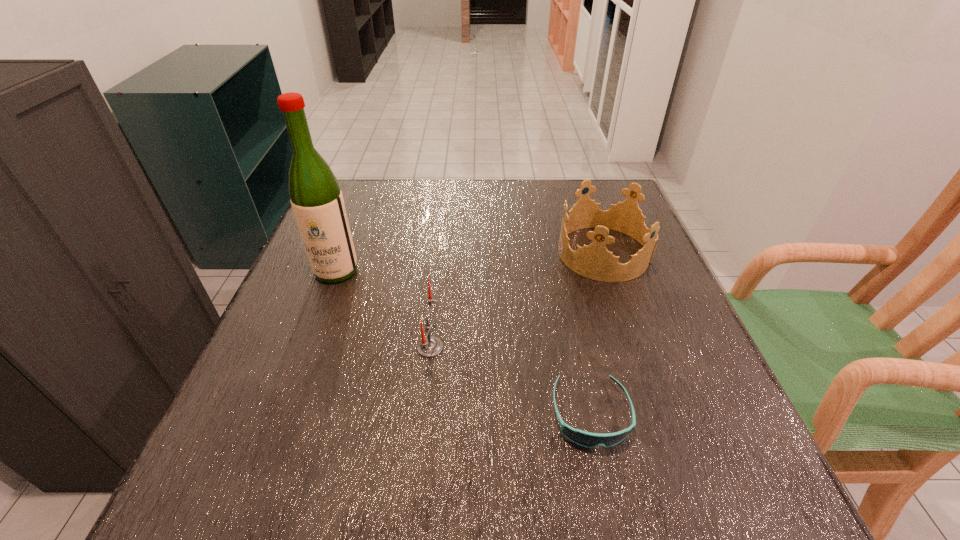
The width and height of the screenshot is (960, 540). What are the coordinates of `vacant space at the near left corner of the desktop` in the screenshot? It's located at (184, 491).

You are a GUI agent. You are given a task and a screenshot of the screen. Output one action in this format:
    pyautogui.click(x=<x>, y=<y>)
    Task: Click on the vacant space at the far right corner
    This screenshot has height=540, width=960.
    Given the screenshot: What is the action you would take?
    pyautogui.click(x=596, y=195)

Find the location of `vacant space in between the tiara and the third object from right to left`. vacant space in between the tiara and the third object from right to left is located at coordinates (517, 300).

Locate an element on the screen. Image resolution: width=960 pixels, height=540 pixels. free space between the liquor and the tiara is located at coordinates (470, 262).

Where is `vacant space that's between the shortest object and the third farthest object`? Image resolution: width=960 pixels, height=540 pixels. vacant space that's between the shortest object and the third farthest object is located at coordinates (511, 381).

Find the location of `free spot between the sunglasses and the second object from left to right`. free spot between the sunglasses and the second object from left to right is located at coordinates (511, 381).

Identify the location of empty space between the third farthest object and the liquor. Image resolution: width=960 pixels, height=540 pixels. (383, 309).

You are a GUI agent. You are given a task and a screenshot of the screen. Output one action in this format:
    pyautogui.click(x=<x>, y=<y>)
    Task: Click on the free spot between the third farthest object and the tiara
    The image size is (960, 540).
    Given the screenshot: What is the action you would take?
    pyautogui.click(x=517, y=300)

This screenshot has height=540, width=960. Identify the location of free space between the liquor and the third farthest object. click(383, 309).

Where is `free area in between the leftmost object and the tiara`? free area in between the leftmost object and the tiara is located at coordinates (470, 262).